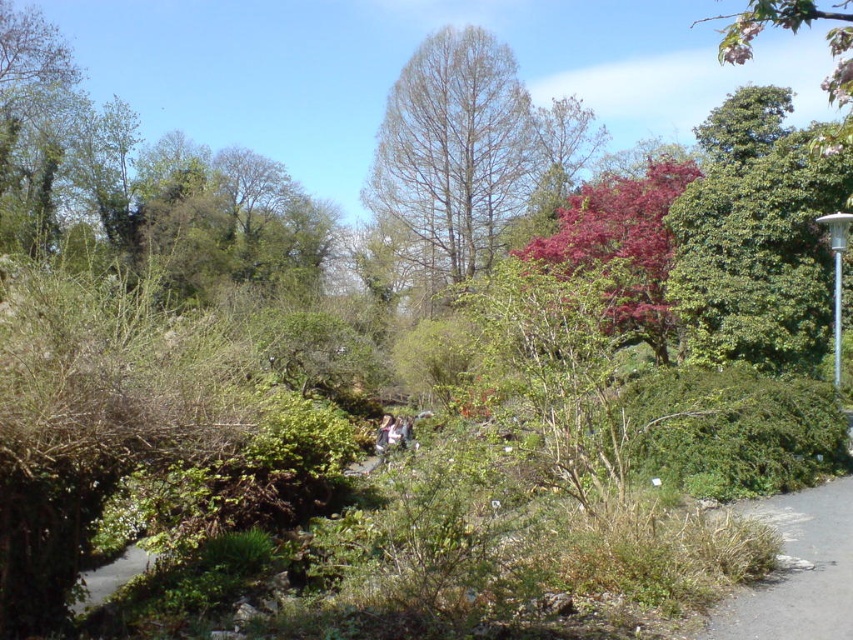
Question: Is bare branches tree at center wider than light brown hair at center?

Choices:
 (A) no
 (B) yes

Answer: (B)

Question: Among these points, which one is farthest from the camera?

Choices:
 (A) (848, 68)
 (B) (378, 452)

Answer: (B)

Question: In this image, where is gray asphalt path at lower right located relative to silver metallic lamp post at right?

Choices:
 (A) right
 (B) left

Answer: (B)

Question: Which object appears closest to the camera in this image?

Choices:
 (A) bare branches tree at center
 (B) pink blossoms at upper right
 (C) gray asphalt path at lower right
 (D) light brown hair at center

Answer: (B)

Question: Does purple glossy tree at upper center have a greater width compared to light brown leather jacket at center?

Choices:
 (A) no
 (B) yes

Answer: (B)

Question: Which point is farther to the camera?

Choices:
 (A) silver metallic lamp post at right
 (B) purple glossy tree at upper center
 (C) gray asphalt path at lower right
 (D) light brown hair at center

Answer: (D)